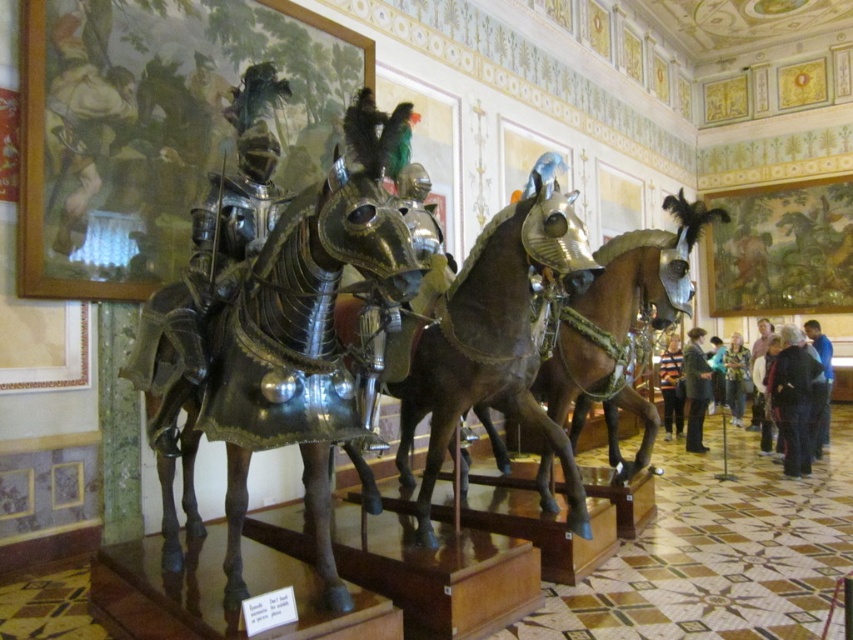
The height and width of the screenshot is (640, 853). What do you see at coordinates (622, 320) in the screenshot?
I see `shiny brown horse at center` at bounding box center [622, 320].

Identify the location of shiny brown horse at center. (622, 320).

Which is below, polished metal horse at center or blue fabric shirt at center?

blue fabric shirt at center

Can you confirm if polished metal horse at center is wider than blue fabric shirt at center?

Yes.

I want to click on polished metal horse at center, so click(302, 348).

In order to click on polished metal horse at center in this screenshot , I will do `click(302, 348)`.

Who is taller, shiny brown horse at center or pink fabric at lower right?

Standing taller between the two is shiny brown horse at center.

Which is behind, point (683, 282) or point (766, 328)?

The point (766, 328) is more distant.

Find the location of `shiny brown horse at center`. shiny brown horse at center is located at coordinates click(x=622, y=320).